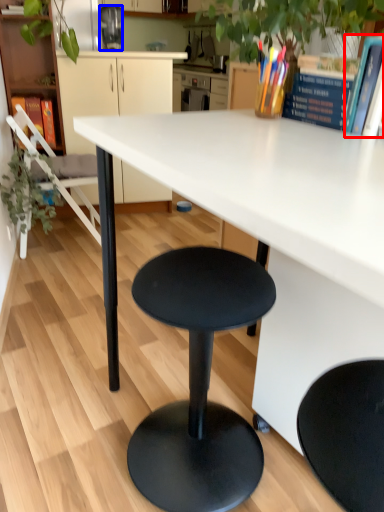
Question: Which of the following is the closest to the observer, book (highlighted by a red box) or appliance (highlighted by a blue box)?

Choices:
 (A) book
 (B) appliance

Answer: (A)